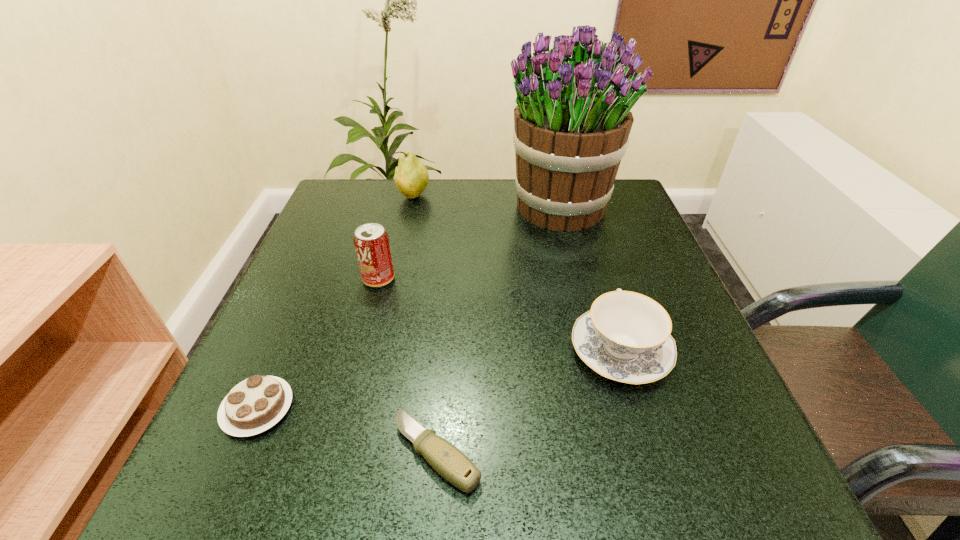
This screenshot has width=960, height=540. In order to click on bouquet in this screenshot , I will do [x=572, y=121].

Identify the location of pear. This screenshot has height=540, width=960. [x=411, y=178].

At what (x,y) coordinates should I click in order to perform the action: click on the fourth nearest object. Please return your answer as a coordinate pair (x, y). The width and height of the screenshot is (960, 540). Looking at the image, I should click on (371, 242).

You are a GUI agent. You are given a task and a screenshot of the screen. Output one action in this format:
    pyautogui.click(x=<x>, y=<y>)
    Task: Click on the third shortest object
    The width and height of the screenshot is (960, 540).
    Given the screenshot: What is the action you would take?
    pyautogui.click(x=625, y=337)

In order to click on the leftmost object in this screenshot , I will do `click(257, 403)`.

The width and height of the screenshot is (960, 540). Find the location of `the fourth object from left to right`. the fourth object from left to right is located at coordinates (447, 460).

Locate an element on the screen. This screenshot has height=540, width=960. pocketknife is located at coordinates (447, 460).

Image resolution: width=960 pixels, height=540 pixels. What are the coordinates of `vacant area located on the left of the tallest object` in the screenshot? It's located at (441, 207).

You are a GUI agent. You are given a task and a screenshot of the screen. Output one action in this format:
    pyautogui.click(x=<x>, y=<y>)
    Task: Click on the free space located 0.370m on the front of the pear
    The width and height of the screenshot is (960, 540).
    Given the screenshot: What is the action you would take?
    pyautogui.click(x=389, y=309)

Locate an element on the screen. This screenshot has width=960, height=540. vacant space situated 0.350m on the right of the soda can is located at coordinates (568, 279).